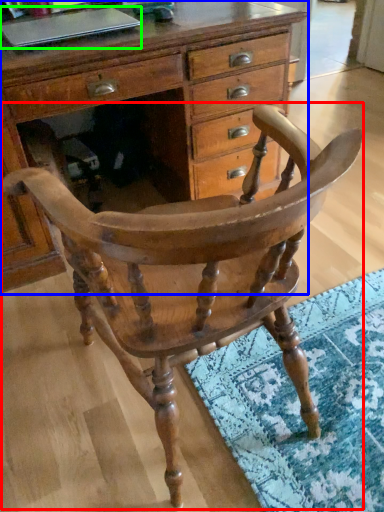
Question: Based on their relative distances, which object is nearer to chair (highlighted by a red box)? Choose from chest of drawers (highlighted by a blue box) and laptop (highlighted by a green box).

Choices:
 (A) chest of drawers
 (B) laptop

Answer: (A)